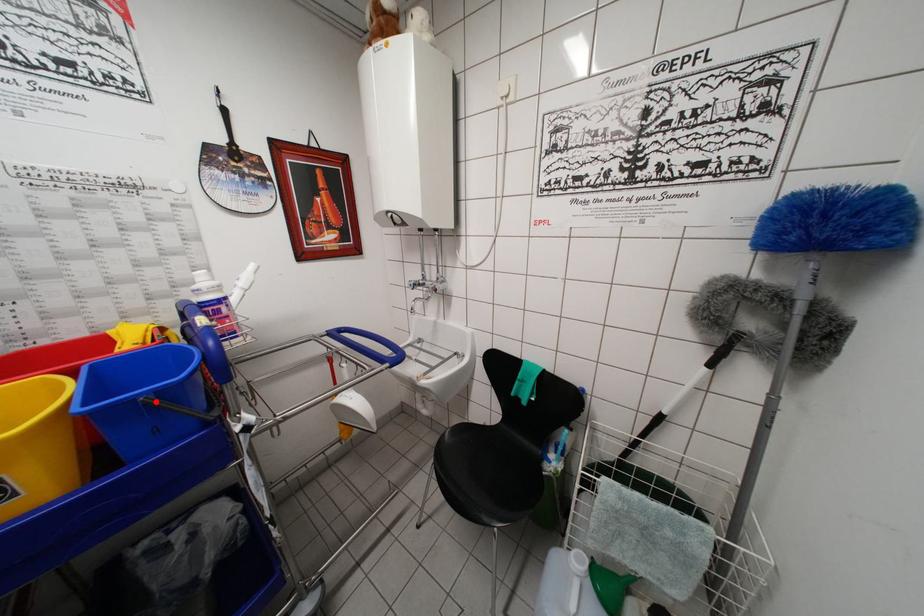
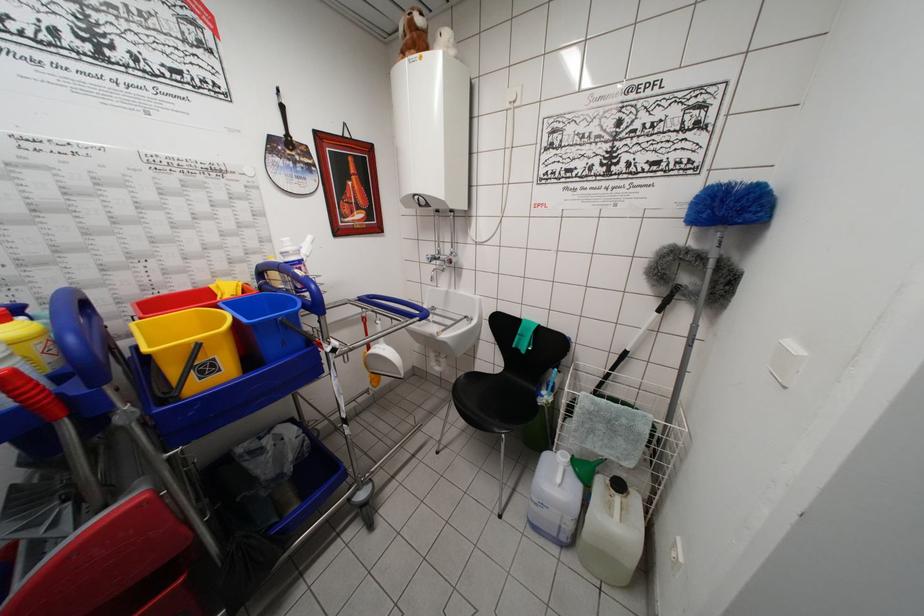
In the second image, find the point that corresponds to the highlighted location in the first image.

(287, 323)